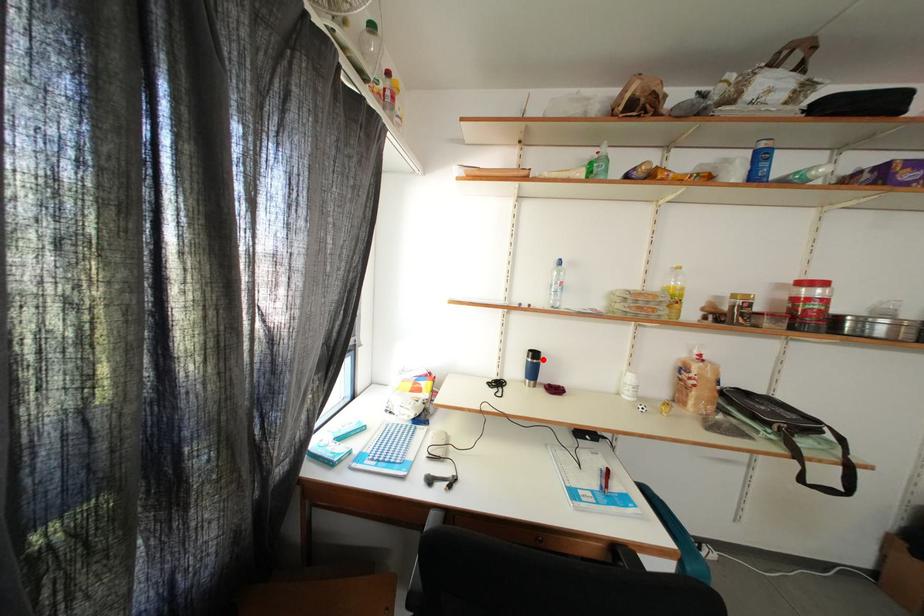
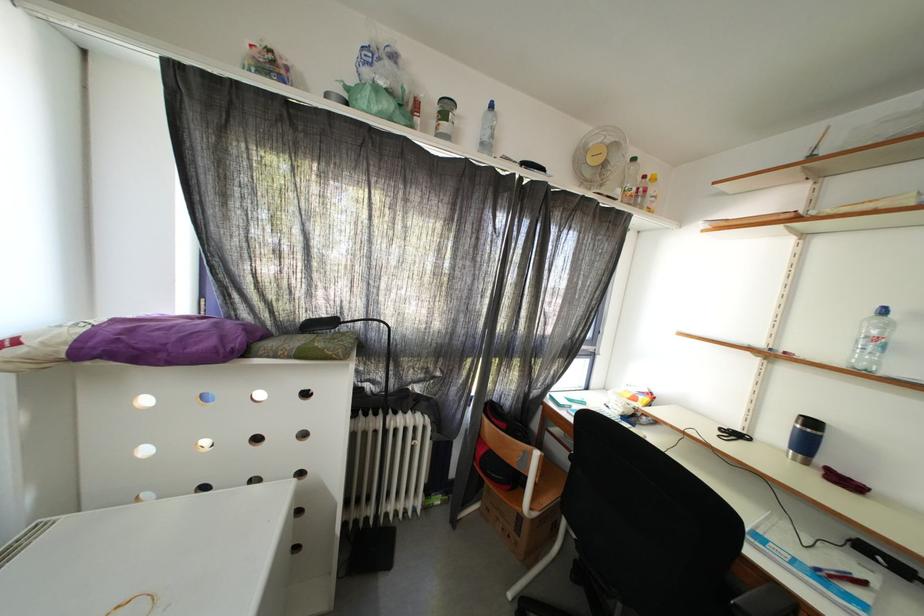
Locate, in the second image, the point that corresponds to the highlighted location in the first image.

(820, 429)